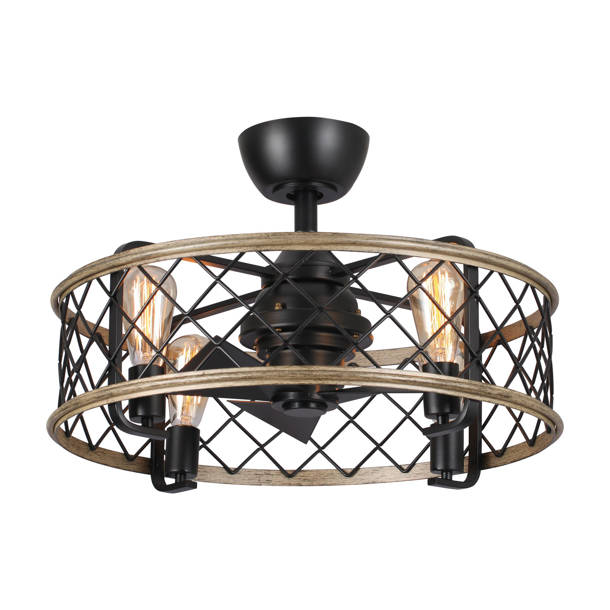
This screenshot has width=610, height=610. I want to click on light on the right side, so click(443, 335), click(460, 360).